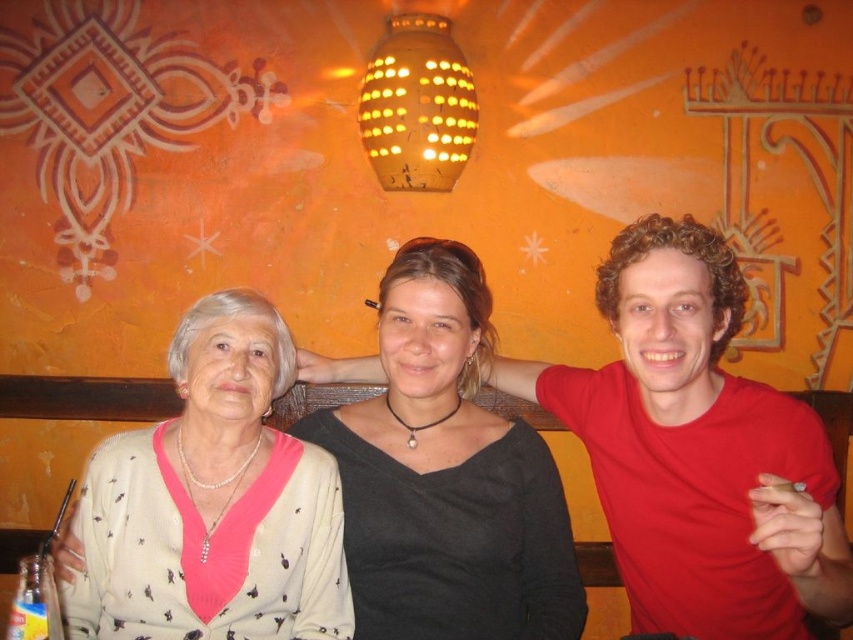
You are a photographer trying to capture a closeup of the pearl necklace at center without including the red matte shirt at center in the frame. Is this possible given their positions?

The red matte shirt at center is positioned on the right side of pearl necklace at center, so if you move your camera to the left of the pearl necklace at center, you can avoid including the red matte shirt at center in the frame.

You are a tailor who needs to determine which of the two shirts, the red matte shirt at center or the black matte shirt at center, requires more fabric for alterations. Based on their sizes, which shirt would need more fabric?

The black matte shirt at center requires more fabric for alterations since its width is greater than the red matte shirt at center.